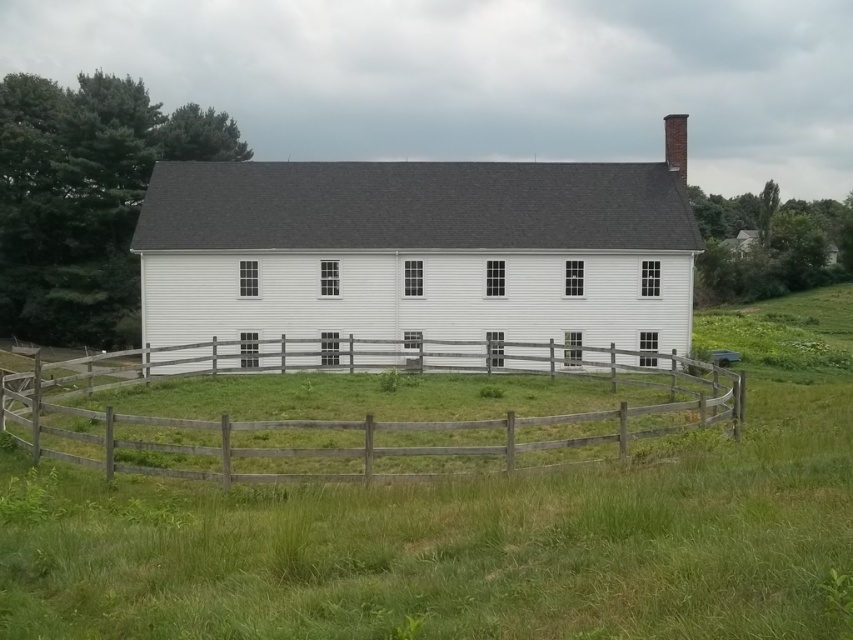
You are standing in front of the building and want to determine the relative positions of two points marked on the facade. Which point is closer to you, point (276, 225) or point (142, 460)?

Point (276, 225) is further to the viewer than point (142, 460), so point (142, 460) is closer to you.

You are a farmer planning to install a new shed next to the white wooden barn at center and the wooden fence at center. Considering their sizes, which one would require more space for construction?

The white wooden barn at center is bigger than the wooden fence at center, so it would require more space for construction.